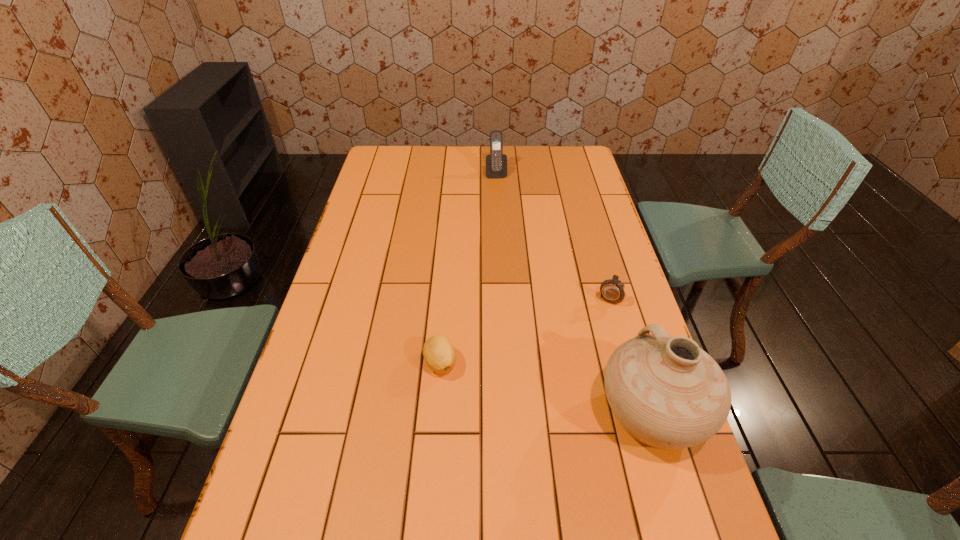
I want to click on free spot on the desktop that is between the leftmost object and the pottery and is positioned on the face of the second shortest object, so click(x=556, y=390).

Where is `vacant space on the desktop that is between the lemon and the tallest object and is positioned on the front-facing side of the farthest object`? The height and width of the screenshot is (540, 960). vacant space on the desktop that is between the lemon and the tallest object and is positioned on the front-facing side of the farthest object is located at coordinates point(529,384).